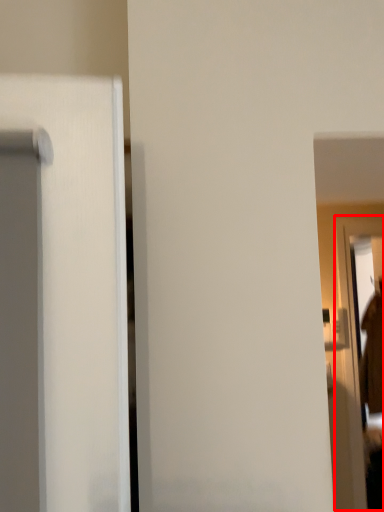
Question: From the image's perspective, what is the correct spatial positioning of screen door (annotated by the red box) in reference to robe?

Choices:
 (A) above
 (B) below

Answer: (A)